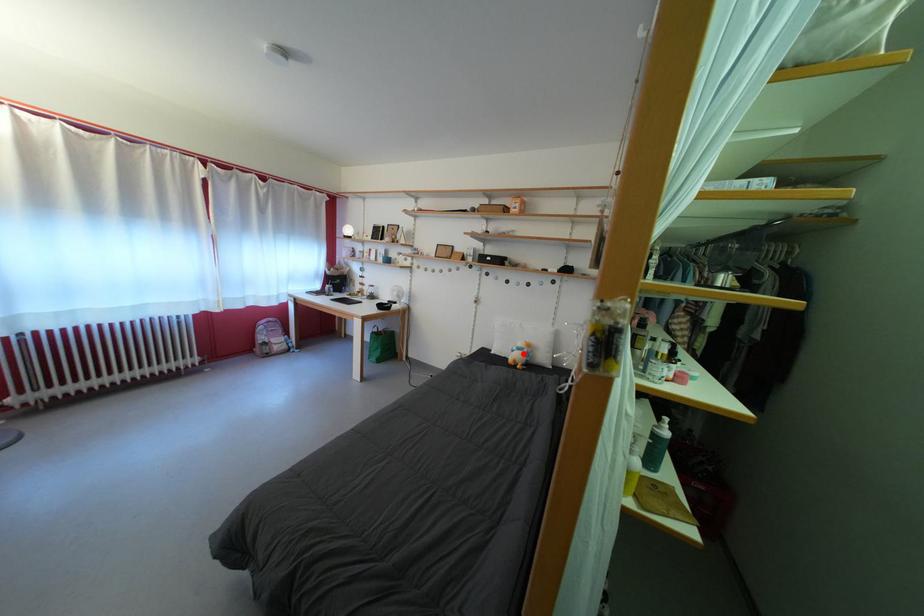
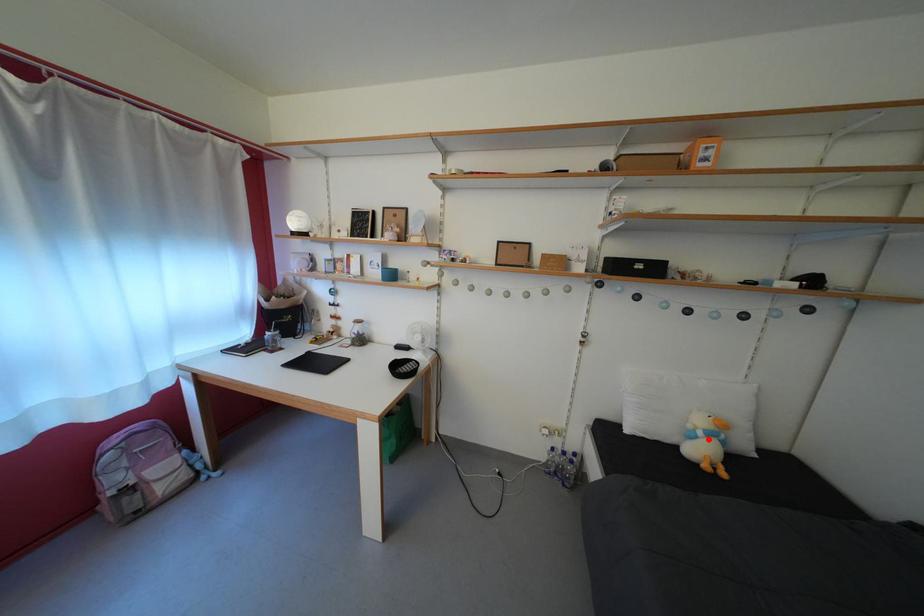
I am providing you with two images of the same scene from different viewpoints. A red point is marked on the first image and another point is marked on the second image. Is the marked point in image1 the same physical position as the marked point in image2?

Yes